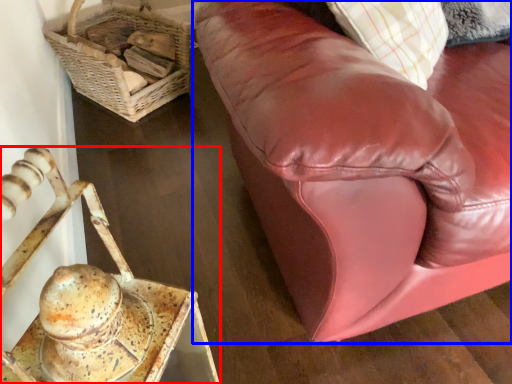
Question: Which point is further to the camera, furniture (highlighted by a red box) or studio couch (highlighted by a blue box)?

Choices:
 (A) furniture
 (B) studio couch

Answer: (B)